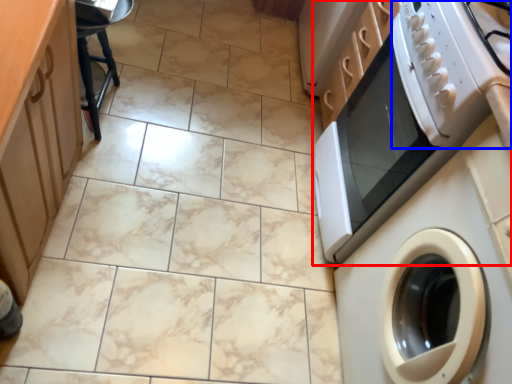
Question: Which object appears closest to the camera in this image, home appliance (highlighted by a red box) or gas stove (highlighted by a blue box)?

Choices:
 (A) home appliance
 (B) gas stove

Answer: (B)